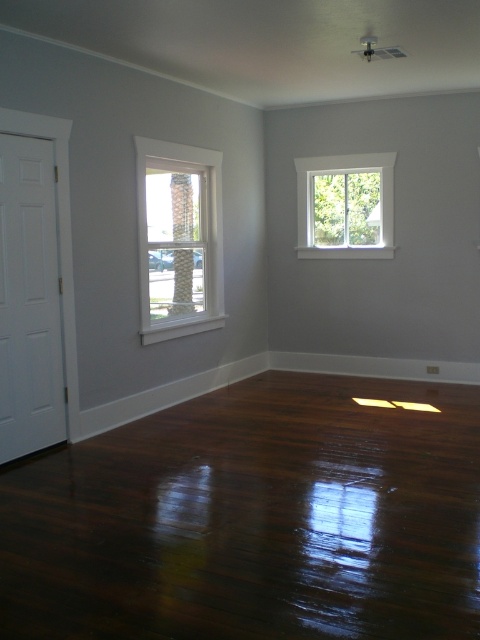
Is white wood window at left to the left of white glass window at upper right from the viewer's perspective?

Correct, you'll find white wood window at left to the left of white glass window at upper right.

How distant is white wood window at left from white glass window at upper right?

white wood window at left and white glass window at upper right are 3.65 meters apart from each other.

At what (x,y) coordinates should I click in order to perform the action: click on white wood window at left. Please return your answer as a coordinate pair (x, y). This screenshot has height=640, width=480. Looking at the image, I should click on pyautogui.click(x=179, y=240).

Can you confirm if shiny dark wood floor at lower center is shorter than white wood window at left?

Incorrect, shiny dark wood floor at lower center's height does not fall short of white wood window at left's.

Does point (334, 625) come behind point (145, 339)?

No, it is not.

Between point (265, 531) and point (144, 304), which one is positioned in front?

Positioned in front is point (265, 531).

The width and height of the screenshot is (480, 640). Identify the location of shiny dark wood floor at lower center. (253, 518).

Does shiny dark wood floor at lower center have a larger size compared to white glass window at upper right?

Yes, shiny dark wood floor at lower center is bigger than white glass window at upper right.

Which is behind, point (284, 516) or point (336, 241)?

Point (336, 241)

Locate an element on the screen. Image resolution: width=480 pixels, height=640 pixels. shiny dark wood floor at lower center is located at coordinates coord(253,518).